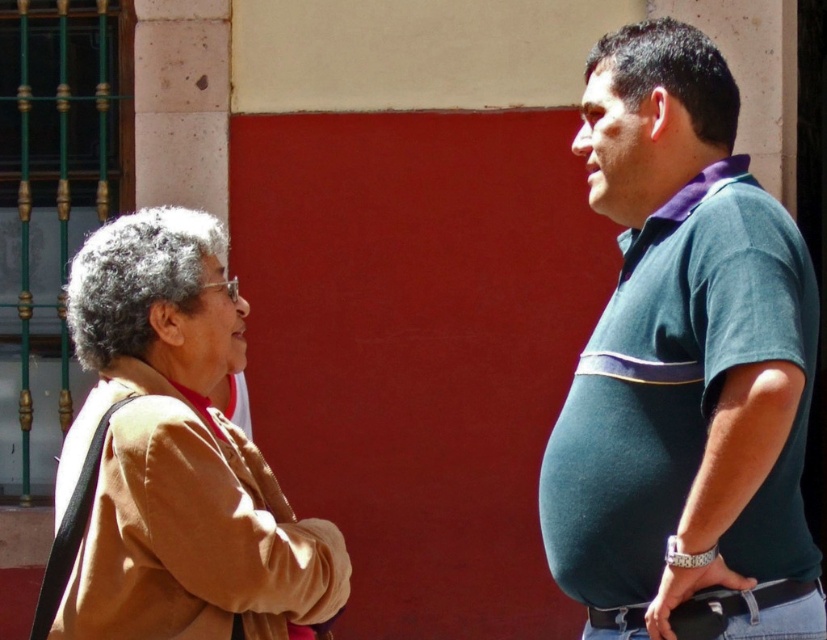
Which is more to the right, green cotton shirt at right or light brown fabric jacket at left?

green cotton shirt at right

Is point (753, 445) closer to camera compared to point (79, 579)?

Yes, it is.

You are a GUI agent. You are given a task and a screenshot of the screen. Output one action in this format:
    pyautogui.click(x=<x>, y=<y>)
    Task: Click on the green cotton shirt at right
    
    Given the screenshot: What is the action you would take?
    pyautogui.click(x=684, y=364)

In order to click on green cotton shirt at right in this screenshot , I will do `click(684, 364)`.